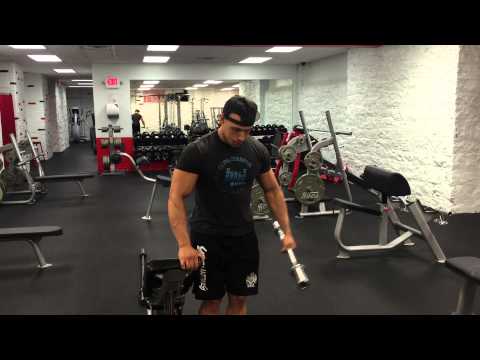
Where is `seats`? seats is located at coordinates (50, 229), (67, 175).